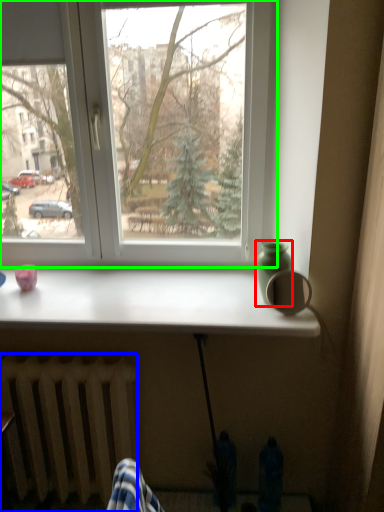
Question: Which object is positioned farthest from glass vase (highlighted by a red box)? Select from radiator (highlighted by a blue box) and window (highlighted by a green box).

Choices:
 (A) radiator
 (B) window

Answer: (A)